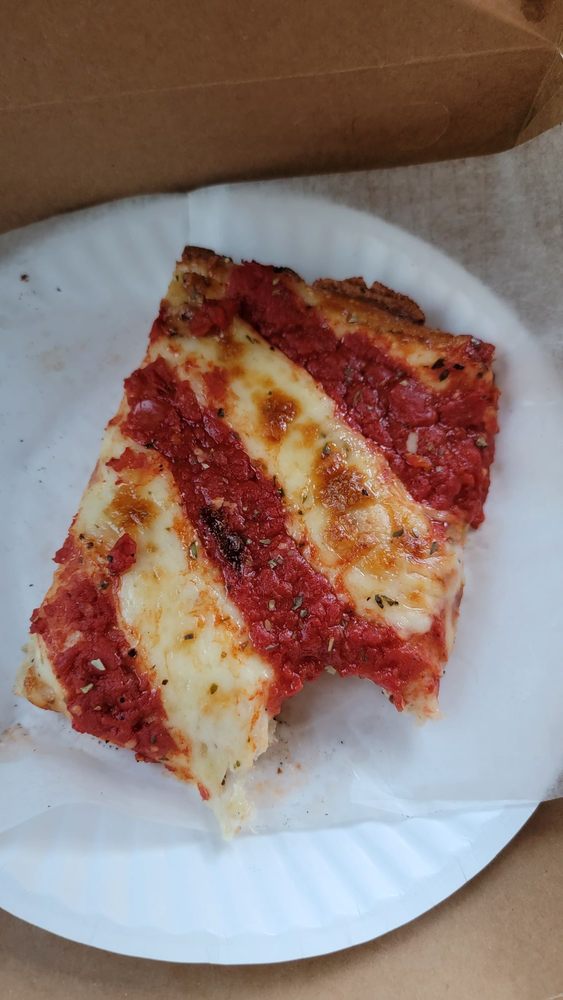
Identify the location of countertop. (489, 966).